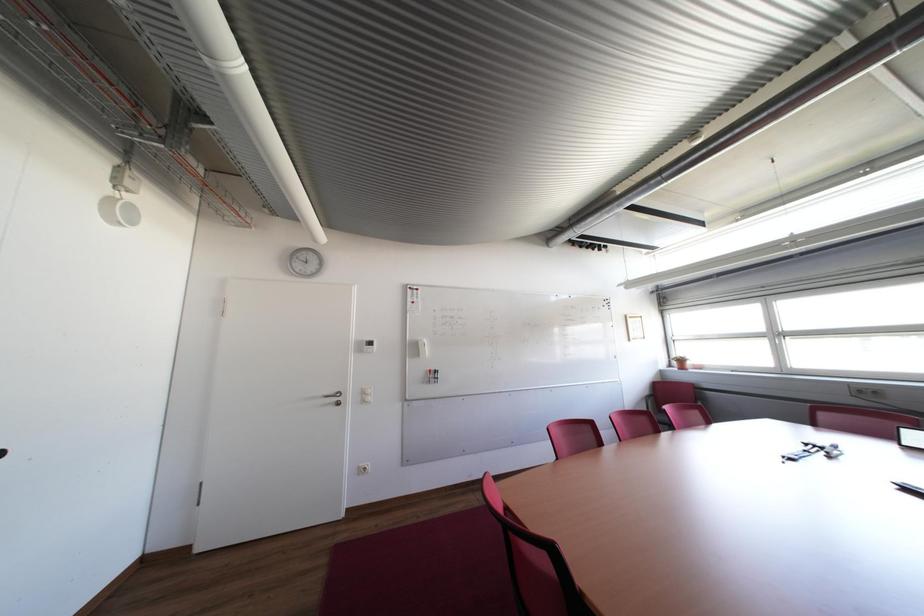
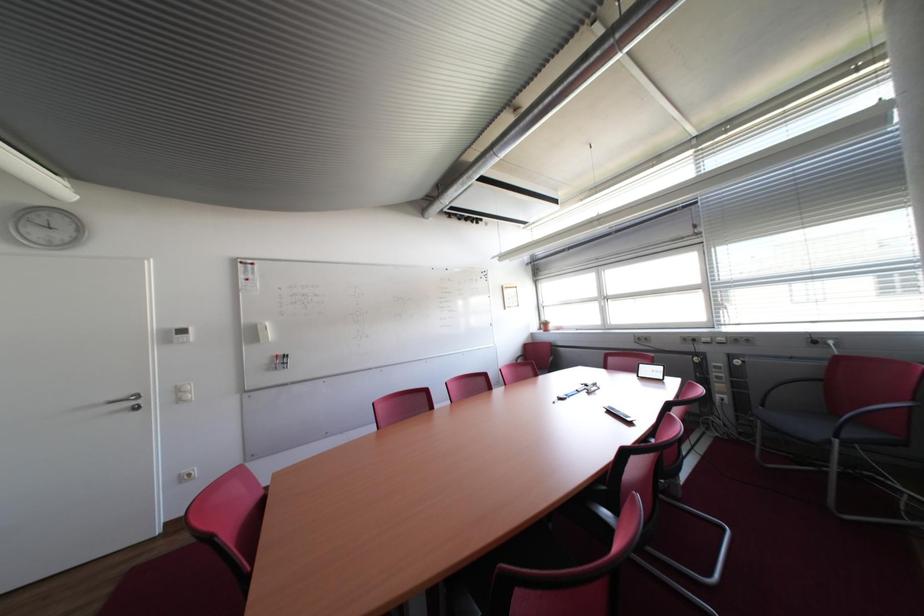
Question: Which direction would the cameraman need to move to produce the second image? Reply with the corresponding letter.

Choices:
 (A) Left
 (B) Right
 (C) Forward
 (D) Backward

Answer: (B)